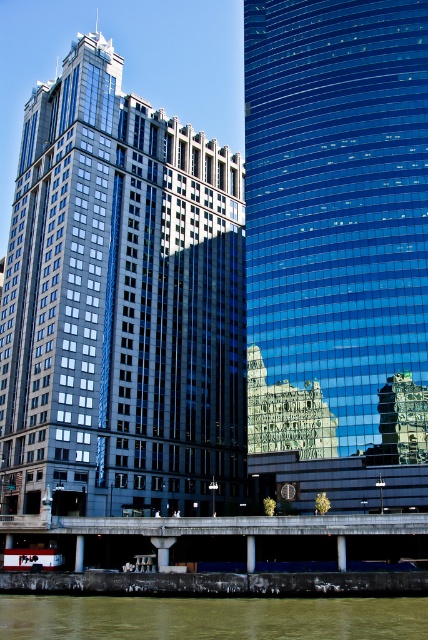
Can you confirm if blue glass skyscraper at center is positioned to the left of greenish water at lower center?

In fact, blue glass skyscraper at center is to the right of greenish water at lower center.

Can you confirm if blue glass skyscraper at center is taller than greenish water at lower center?

Indeed, blue glass skyscraper at center has a greater height compared to greenish water at lower center.

This screenshot has width=428, height=640. Describe the element at coordinates (336, 196) in the screenshot. I see `blue glass skyscraper at center` at that location.

Locate an element on the screen. This screenshot has width=428, height=640. blue glass skyscraper at center is located at coordinates (336, 196).

Is shiny glass skyscraper at center positioned in front of greenish water at lower center?

That is False.

Looking at this image, between shiny glass skyscraper at center and greenish water at lower center, which one appears on the left side from the viewer's perspective?

shiny glass skyscraper at center

Does point (234, 184) lie in front of point (356, 614)?

That is False.

Find the location of a particular element. shiny glass skyscraper at center is located at coordinates (121, 305).

Who is positioned more to the right, shiny glass skyscraper at center or blue glass skyscraper at center?

blue glass skyscraper at center is more to the right.

Consider the image. Does shiny glass skyscraper at center have a greater height compared to blue glass skyscraper at center?

Yes.

Which is behind, point (190, 240) or point (282, 260)?

Positioned behind is point (190, 240).

Locate an element on the screen. shiny glass skyscraper at center is located at coordinates (121, 305).